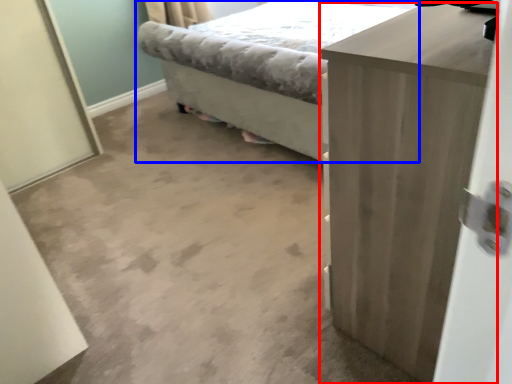
Question: Which of the following is the farthest to the observer, chest of drawers (highlighted by a red box) or bed (highlighted by a blue box)?

Choices:
 (A) chest of drawers
 (B) bed

Answer: (B)